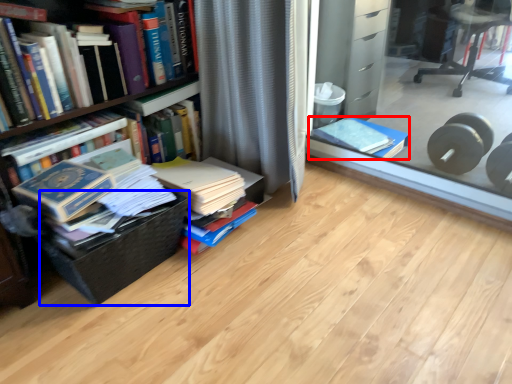
Question: Among these objects, which one is farthest to the camera, book (highlighted by a red box) or basket (highlighted by a blue box)?

Choices:
 (A) book
 (B) basket

Answer: (A)